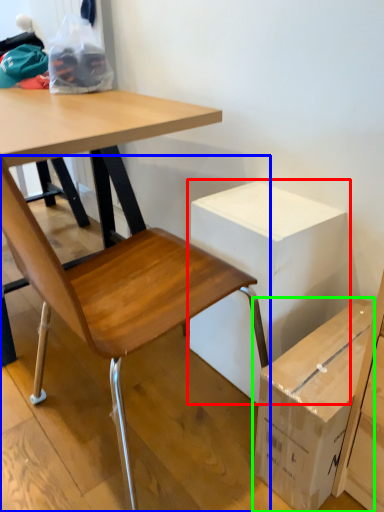
Question: Based on their relative distances, which object is nearer to cardboard box (highlighted by a red box)? Choose from chair (highlighted by a blue box) and box (highlighted by a green box).

Choices:
 (A) chair
 (B) box

Answer: (A)